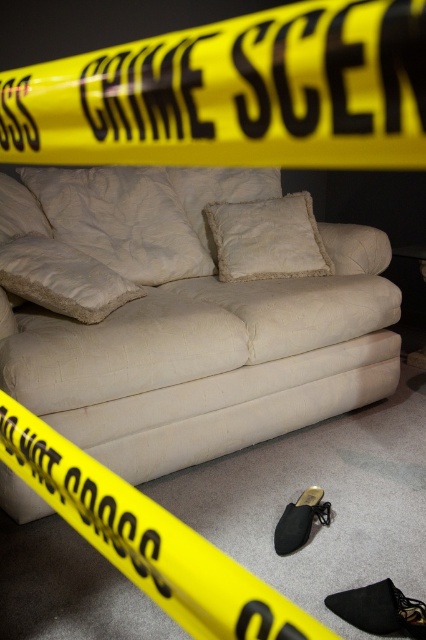
Can you confirm if white textured pillow at center is thinner than fuzzy white pillow at center?

Incorrect, white textured pillow at center's width is not less than fuzzy white pillow at center's.

Which is in front, point (94, 180) or point (279, 198)?

Point (94, 180) is more forward.

Where is `white textured pillow at center`? white textured pillow at center is located at coordinates (121, 220).

Does yellow plastic tape at lower center have a lesser width compared to fuzzy white pillow at center?

Yes.

Does yellow plastic tape at lower center lie in front of fuzzy white pillow at center?

Yes, it is.

Which is in front, point (215, 577) or point (308, 237)?

Point (215, 577) is more forward.

Find the location of a particular element. yellow plastic tape at lower center is located at coordinates (147, 540).

Is point (112, 403) behind point (123, 214)?

No, it is not.

Is point (198, 228) less distant than point (172, 250)?

No, it is behind (172, 250).

Locate an element on the screen. The image size is (426, 640). white fabric couch at center is located at coordinates (201, 320).

You are a GUI agent. You are given a task and a screenshot of the screen. Output one action in this format:
    pyautogui.click(x=<x>, y=<y>)
    Task: Click on the white fabric couch at center
    This screenshot has width=426, height=640.
    Given the screenshot: What is the action you would take?
    pyautogui.click(x=201, y=320)